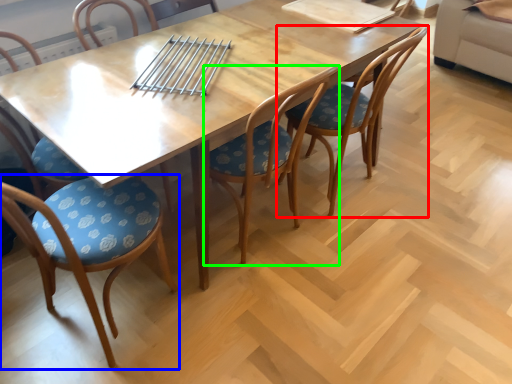
Question: Which object is positioned farthest from chair (highlighted by a red box)? Select from chair (highlighted by a blue box) and chair (highlighted by a green box).

Choices:
 (A) chair
 (B) chair

Answer: (A)